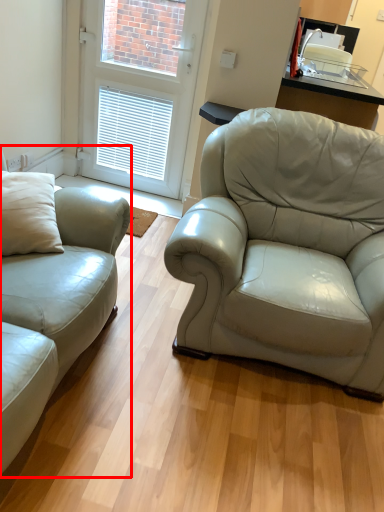
Question: From the image's perspective, where is studio couch (annotated by the red box) located relative to door?

Choices:
 (A) below
 (B) above

Answer: (A)